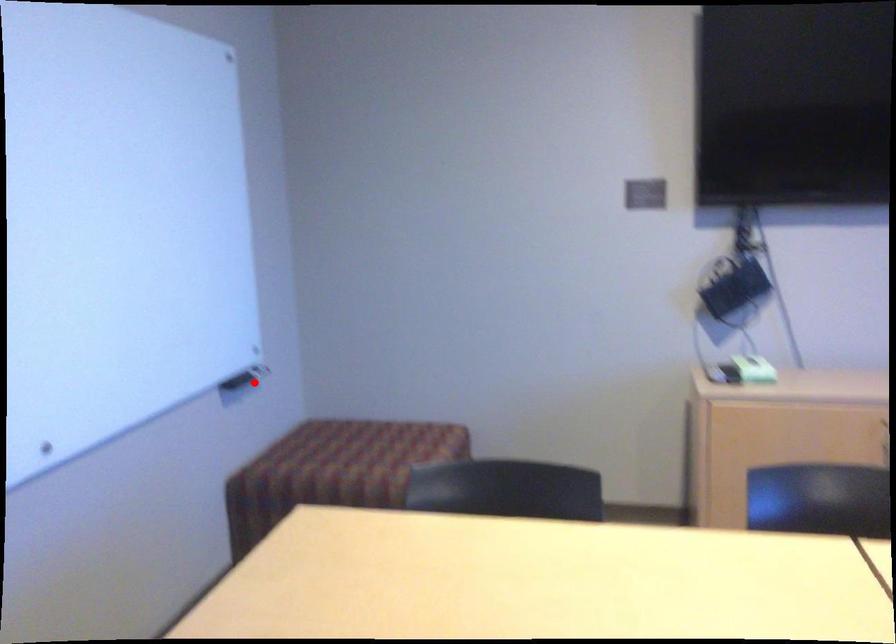
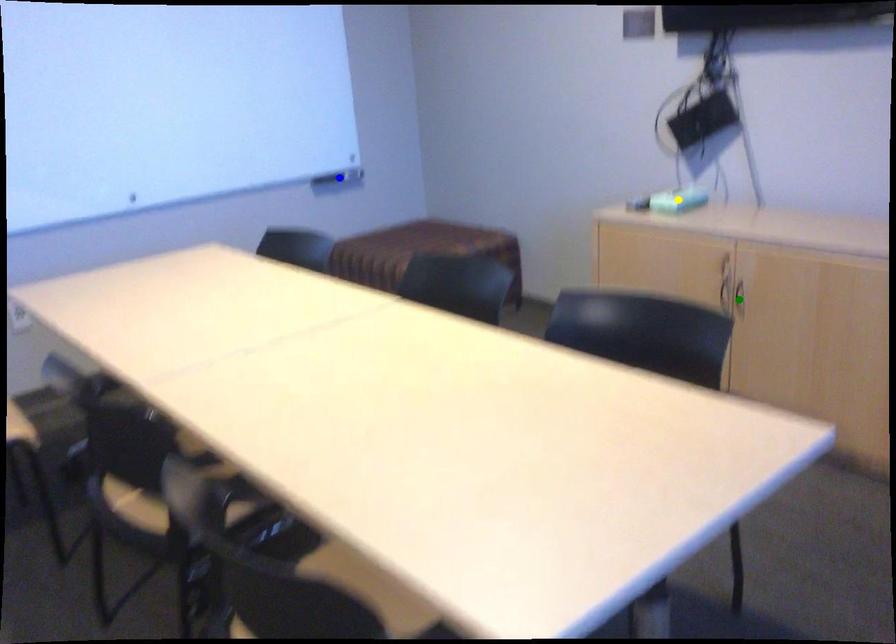
Question: I am providing you with two images of the same scene from different viewpoints. A red point is marked on the first image. You are given multiple points on the second image. Which point in image 2 is actually the same real-world point as the red point in image 1?

Choices:
 (A) yellow point
 (B) green point
 (C) blue point

Answer: (C)